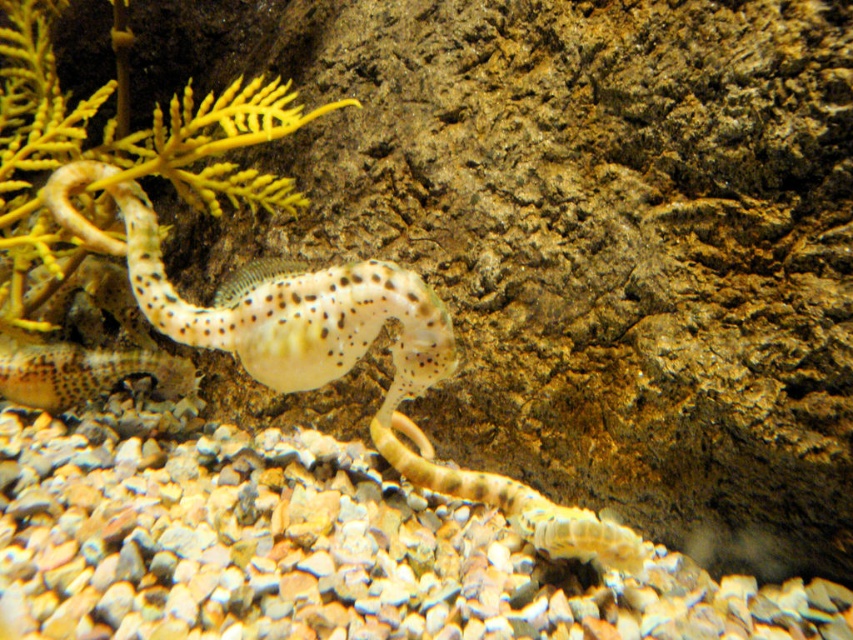
You are an underwater explorer observing the image. You see the yellow leafy plant at upper left and the speckled translucent seahorse at center. Which object has a greater width?

The yellow leafy plant at upper left might be wider than the speckled translucent seahorse at center, so the yellow leafy plant at upper left possibly has a greater width.

You are an underwater photographer aiming to capture a closeup shot of the speckled translucent gecko at center. Your camera has a minimum focusing distance of 3.5 feet. Will you be able to take a clear photo without moving the camera closer?

The speckled translucent gecko at center is 4.07 feet away from the camera. Since the minimum focusing distance is 3.5 feet, the camera cannot focus clearly at that distance. You need to move closer to within 3.5 feet for a sharp image.